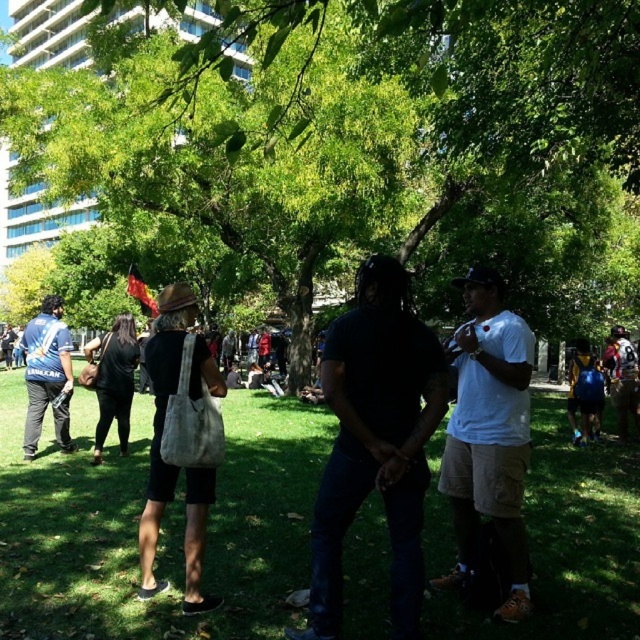
Question: Which point is closer to the camera taking this photo?

Choices:
 (A) (358, 433)
 (B) (572, 356)
 (C) (481, 454)
 (D) (595, 305)

Answer: (A)

Question: Which of the following is the closest to the observer?

Choices:
 (A) (48, 541)
 (B) (340, 506)
 (C) (625, 358)
 (D) (49, 308)

Answer: (B)

Question: Which point appears closest to the camera in this image?

Choices:
 (A) (508, 611)
 (B) (115, 337)

Answer: (A)

Question: From the image, what is the correct spatial relationship of leather-like beige bag at center in relation to camouflage-patterned backpack at right?

Choices:
 (A) below
 (B) above

Answer: (A)

Question: Is black matte shirt at center bigger than white cotton shirt at center?

Choices:
 (A) no
 (B) yes

Answer: (B)

Question: Is matte blue shirt at left thinner than blue backpack at right?

Choices:
 (A) yes
 (B) no

Answer: (B)